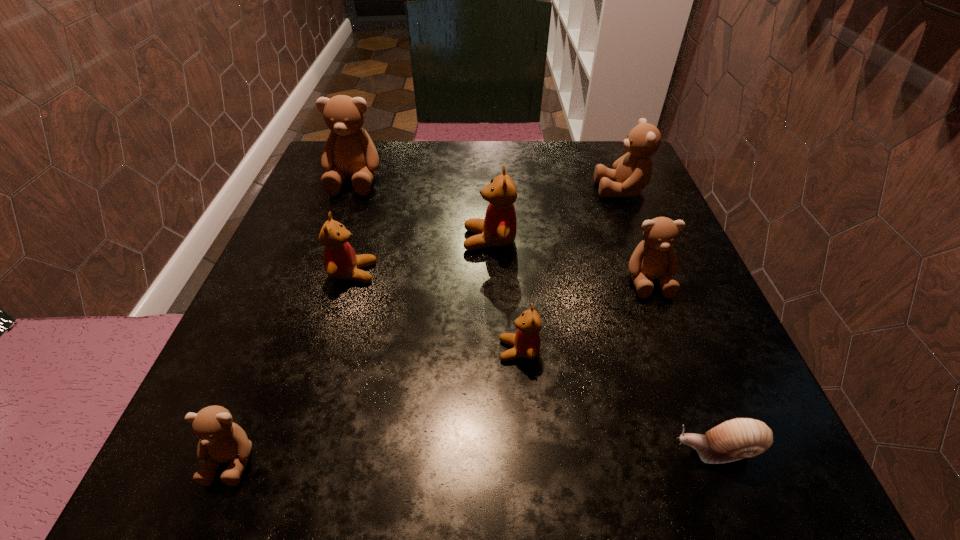
At what (x,y) coordinates should I click in order to perform the action: click on free space located 0.090m on the front-facing side of the sixth farthest teddy bear. Please return your answer as a coordinate pair (x, y). Image resolution: width=960 pixels, height=540 pixels. Looking at the image, I should click on (440, 350).

I want to click on vacant point located 0.350m on the front-facing side of the sixth farthest teddy bear, so click(266, 350).

Where is `vacant position located 0.120m on the front-facing side of the sixth farthest teddy bear`? The image size is (960, 540). vacant position located 0.120m on the front-facing side of the sixth farthest teddy bear is located at coordinates (420, 350).

Where is `blank space located on the front-facing side of the escargot`? blank space located on the front-facing side of the escargot is located at coordinates click(520, 451).

Find the location of `free space located 0.250m on the front-facing side of the escargot`. free space located 0.250m on the front-facing side of the escargot is located at coordinates (472, 451).

You are a GUI agent. You are given a task and a screenshot of the screen. Output one action in this format:
    pyautogui.click(x=<x>, y=<y>)
    Task: Click on the free spot located 0.250m on the front-facing side of the escargot
    The width and height of the screenshot is (960, 540).
    Given the screenshot: What is the action you would take?
    pyautogui.click(x=472, y=451)

This screenshot has height=540, width=960. In order to click on teddy bear situated at the near edge in this screenshot , I will do `click(221, 440)`.

Find the location of a particular element. The image size is (960, 540). escargot located at the near edge is located at coordinates (739, 438).

Where is `escargot at the right edge`? This screenshot has height=540, width=960. escargot at the right edge is located at coordinates (739, 438).

The height and width of the screenshot is (540, 960). What are the coordinates of `object that is at the far left corner` in the screenshot? It's located at (349, 151).